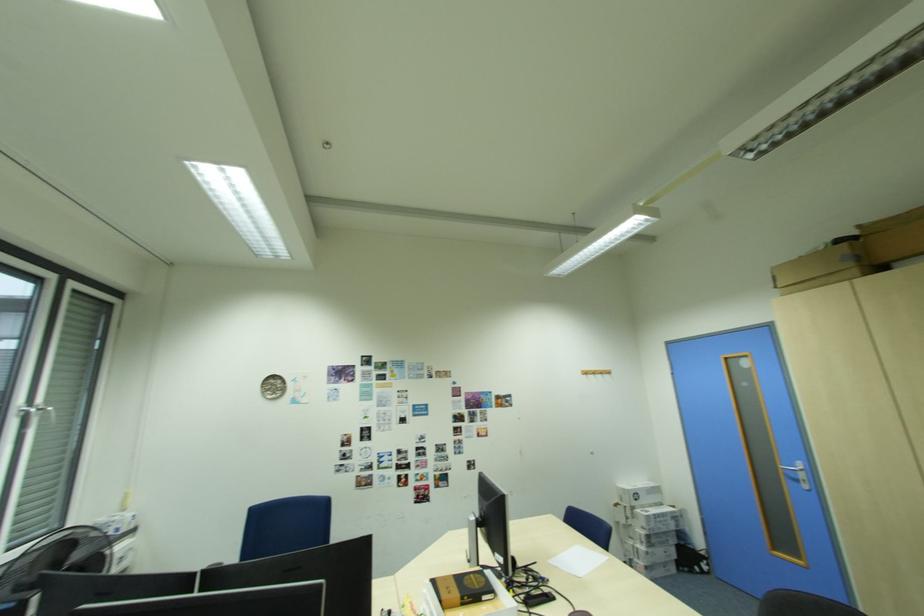
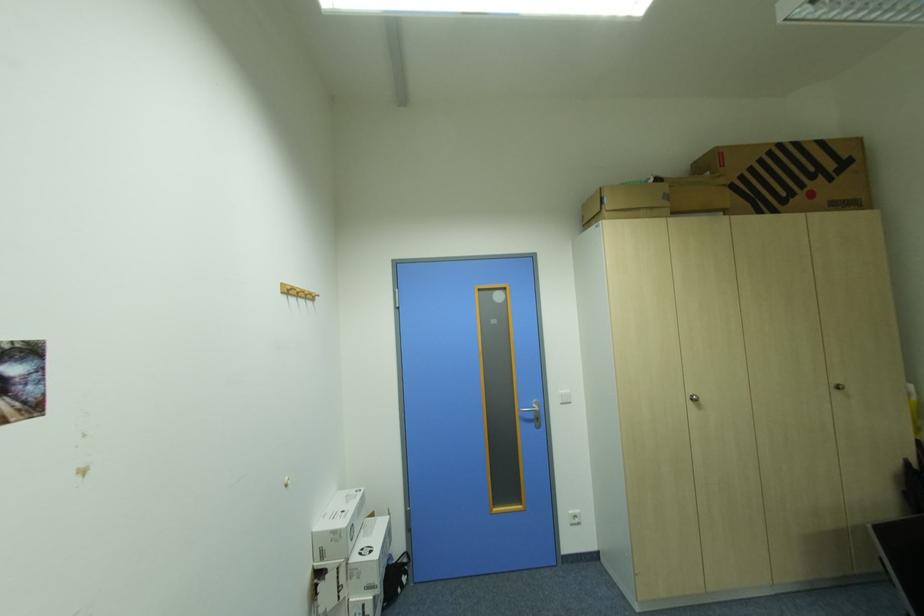
Locate, in the second image, the point that corresponds to the point at 630,490 in the first image.

(341, 533)